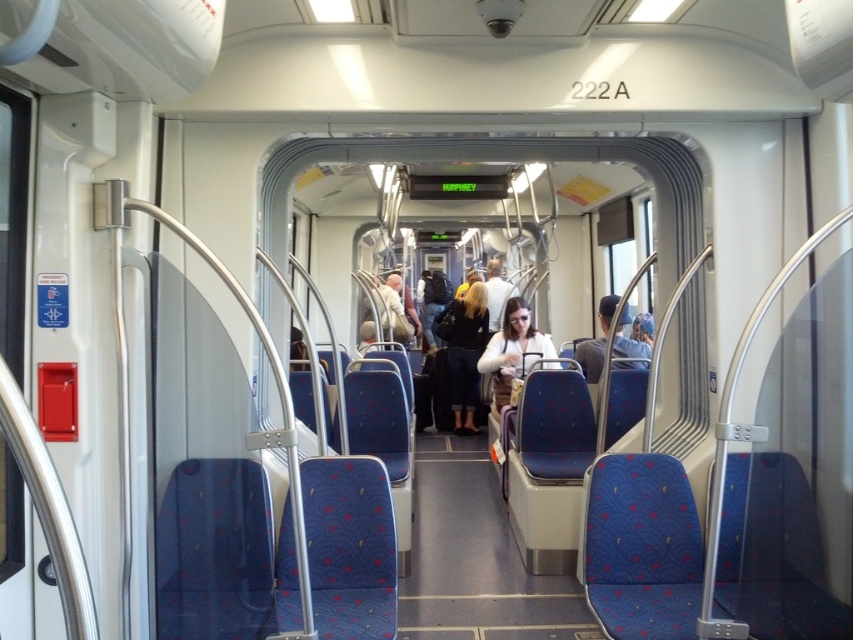
Does matte white jacket at center appear under denim jacket at center?

Yes.

Image resolution: width=853 pixels, height=640 pixels. Describe the element at coordinates (514, 353) in the screenshot. I see `matte white jacket at center` at that location.

Is point (543, 364) closer to camera compared to point (579, 348)?

That is True.

Identify the location of matte white jacket at center. This screenshot has width=853, height=640. (514, 353).

In the scene shown: Who is shorter, dark blue fabric coat at center or matte white jacket at center?

With less height is matte white jacket at center.

Does dark blue fabric coat at center have a greater height compared to matte white jacket at center?

Correct, dark blue fabric coat at center is much taller as matte white jacket at center.

Is point (454, 371) behind point (505, 394)?

Yes, it is behind point (505, 394).

Find the location of `dark blue fabric coat at center`. dark blue fabric coat at center is located at coordinates (463, 352).

Identify the location of dark blue fabric coat at center. (463, 352).

Is the position of dark blue fabric coat at center more distant than that of denim jacket at center?

Yes, dark blue fabric coat at center is behind denim jacket at center.

Does point (459, 404) lie in front of point (650, 355)?

No.

You are a GUI agent. You are given a task and a screenshot of the screen. Output one action in this format:
    pyautogui.click(x=<x>, y=<y>)
    Task: Click on the dark blue fabric coat at center
    
    Given the screenshot: What is the action you would take?
    pyautogui.click(x=463, y=352)